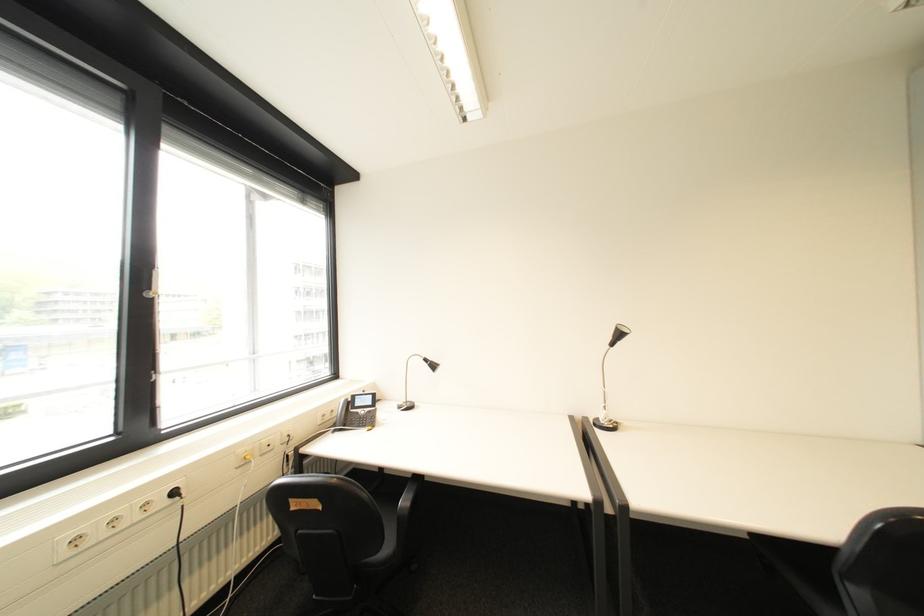
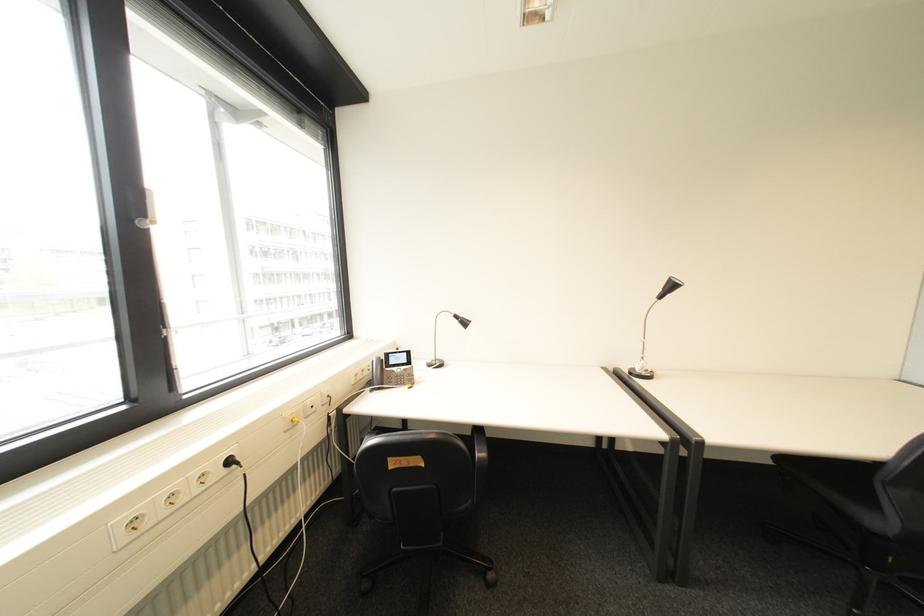
In the second image, find the point that corresponds to (153,293) in the first image.

(146, 220)